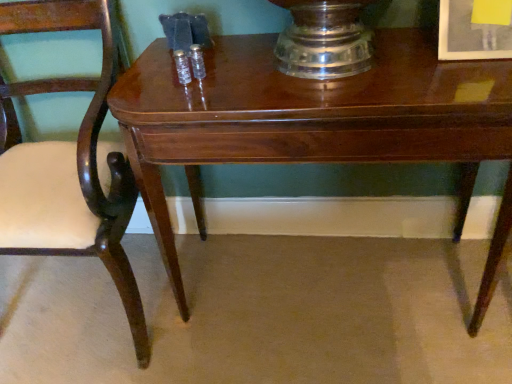
Question: Does glossy wood table at center have a lesser height compared to matte white picture frame at upper right?

Choices:
 (A) no
 (B) yes

Answer: (A)

Question: Considering the relative sizes of glossy wood table at center and matte white picture frame at upper right in the image provided, is glossy wood table at center taller than matte white picture frame at upper right?

Choices:
 (A) yes
 (B) no

Answer: (A)

Question: From the image's perspective, would you say glossy wood table at center is positioned over matte white picture frame at upper right?

Choices:
 (A) yes
 (B) no

Answer: (B)

Question: Is matte white picture frame at upper right at the back of glossy wood table at center?

Choices:
 (A) yes
 (B) no

Answer: (B)

Question: Could you tell me if glossy wood table at center is turned towards matte white picture frame at upper right?

Choices:
 (A) yes
 (B) no

Answer: (B)

Question: Can you confirm if glossy wood table at center is thinner than matte white picture frame at upper right?

Choices:
 (A) no
 (B) yes

Answer: (A)

Question: From a real-world perspective, is matte white picture frame at upper right located beneath glossy wood table at center?

Choices:
 (A) no
 (B) yes

Answer: (A)

Question: Can you confirm if matte white picture frame at upper right is thinner than glossy wood table at center?

Choices:
 (A) no
 (B) yes

Answer: (B)

Question: Is matte white picture frame at upper right wider than glossy wood table at center?

Choices:
 (A) yes
 (B) no

Answer: (B)

Question: Is the depth of matte white picture frame at upper right greater than that of glossy wood table at center?

Choices:
 (A) yes
 (B) no

Answer: (A)

Question: Is matte white picture frame at upper right completely or partially outside of glossy wood table at center?

Choices:
 (A) yes
 (B) no

Answer: (A)

Question: Is matte white picture frame at upper right facing towards glossy wood table at center?

Choices:
 (A) yes
 (B) no

Answer: (B)

Question: Is mahogany wood chair at left turned away from glossy wood table at center?

Choices:
 (A) no
 (B) yes

Answer: (A)